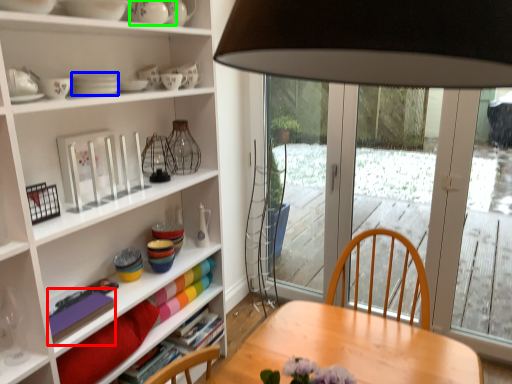
Question: Considering the real-world distances, which object is farthest from book (highlighted by a red box)? tableware (highlighted by a blue box) or tableware (highlighted by a green box)?

Choices:
 (A) tableware
 (B) tableware

Answer: (B)